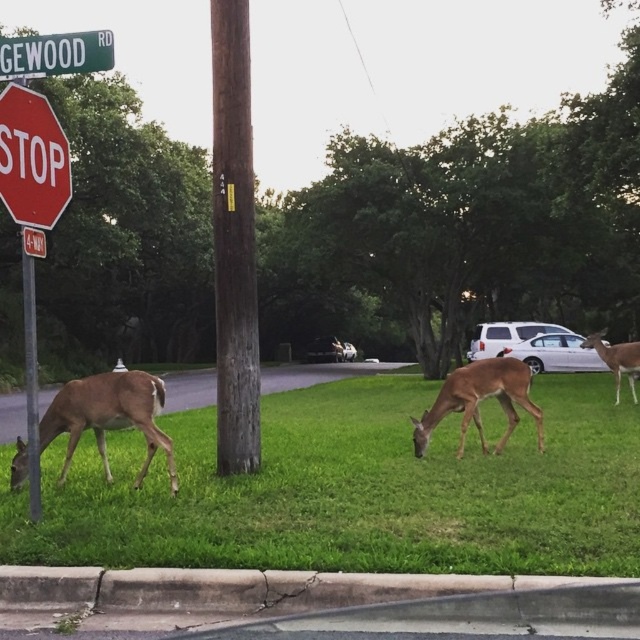
You are a delivery driver approaching the intersection and need to see both the red matte stop sign at left and the brown velvet deer at right. Which object will appear taller from your perspective?

The brown velvet deer at right appears taller because it is taller than the red matte stop sign at left.

You are a photographer trying to capture both the red matte stop sign at left and the brown velvet deer at right in a single frame. Based on their sizes in the image, which object should you focus on first to ensure both are in the frame?

The red matte stop sign at left occupies less space than the brown velvet deer at right, so you should focus on the brown velvet deer at right first to ensure both fit in the frame.